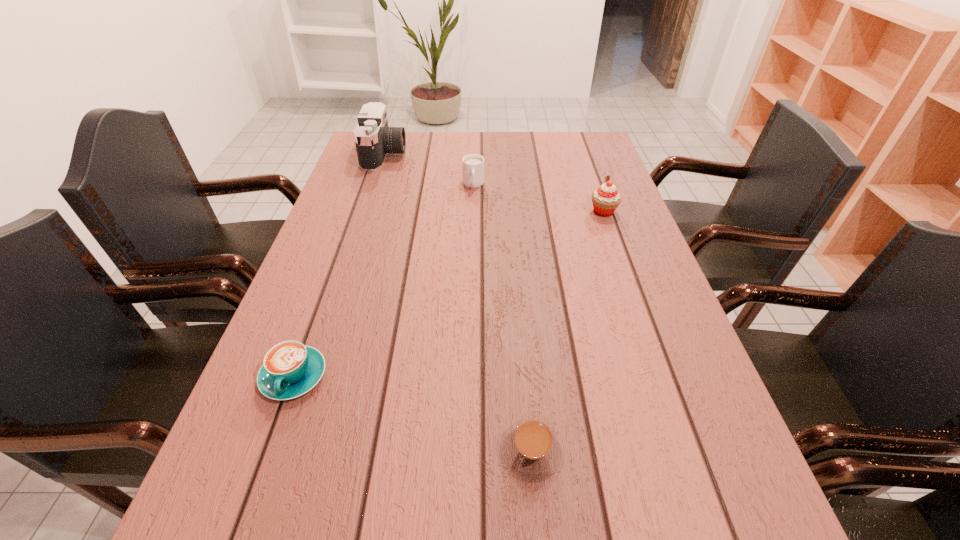
Locate an element on the screen. The image size is (960, 540). blank area located on the front-facing side of the farthest object is located at coordinates (484, 154).

You are a GUI agent. You are given a task and a screenshot of the screen. Output one action in this format:
    pyautogui.click(x=<x>, y=<y>)
    Task: Click on the free location located on the back of the rightmost object
    The height and width of the screenshot is (540, 960).
    Given the screenshot: What is the action you would take?
    [x=595, y=191]

Image resolution: width=960 pixels, height=540 pixels. I want to click on vacant area located 0.260m on the side with the handle of the farthest cappuccino, so click(472, 249).

The image size is (960, 540). I want to click on vacant region located with the handle on the right side of the leftmost cappuccino, so click(261, 466).

This screenshot has width=960, height=540. What are the coordinates of `vacant space situated on the back of the nearest object` in the screenshot? It's located at (519, 305).

At what (x,y) coordinates should I click in order to perform the action: click on object located in the far edge section of the desktop. Please return your answer as a coordinate pair (x, y). This screenshot has width=960, height=540. Looking at the image, I should click on (374, 139).

Image resolution: width=960 pixels, height=540 pixels. What are the coordinates of `camera at the left edge` in the screenshot? It's located at (374, 139).

This screenshot has width=960, height=540. I want to click on cappuccino that is at the left edge, so pyautogui.click(x=290, y=369).

This screenshot has height=540, width=960. I want to click on object at the right edge, so click(605, 199).

Where is `object that is positioned at the far left corner`? This screenshot has height=540, width=960. object that is positioned at the far left corner is located at coordinates (374, 139).